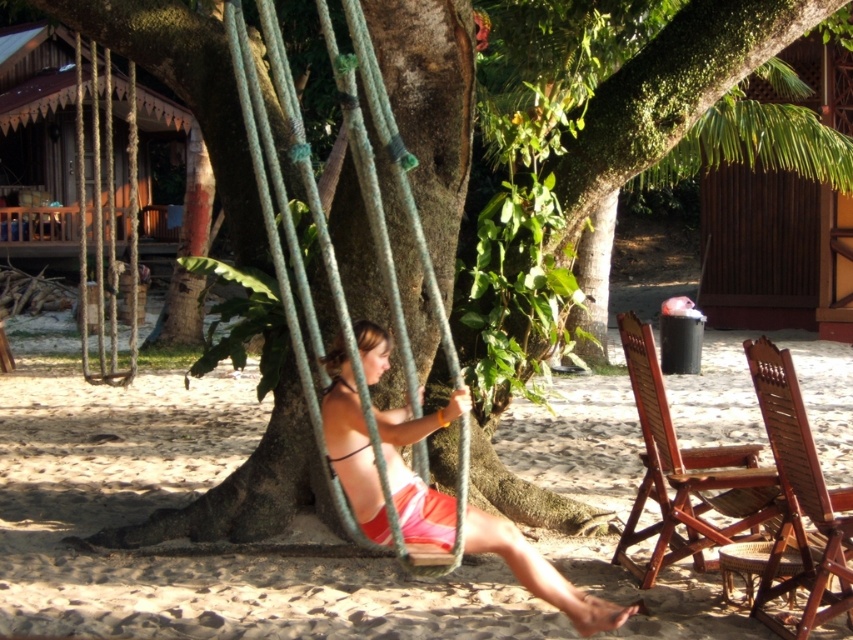
Question: Estimate the real-world distances between objects in this image. Which object is closer to the matte black bikini top at center?

Choices:
 (A) rope swing at center
 (B) wooden textured beach chair at lower right

Answer: (A)

Question: Which of the following is the farthest from the observer?

Choices:
 (A) (358, 449)
 (B) (376, 330)
 (C) (265, 3)

Answer: (B)

Question: Which of the following is the farthest from the observer?

Choices:
 (A) matte rope swing at center
 (B) rope swing at center
 (C) wooden wicker beach chair at lower right

Answer: (A)

Question: Does rope swing at center appear on the right side of matte pink bikini at center?

Choices:
 (A) no
 (B) yes

Answer: (A)

Question: Can you confirm if wooden textured beach chair at lower right is positioned below matte black bikini top at center?

Choices:
 (A) no
 (B) yes

Answer: (B)

Question: Does matte rope swing at center appear on the left side of matte black bikini top at center?

Choices:
 (A) no
 (B) yes

Answer: (B)